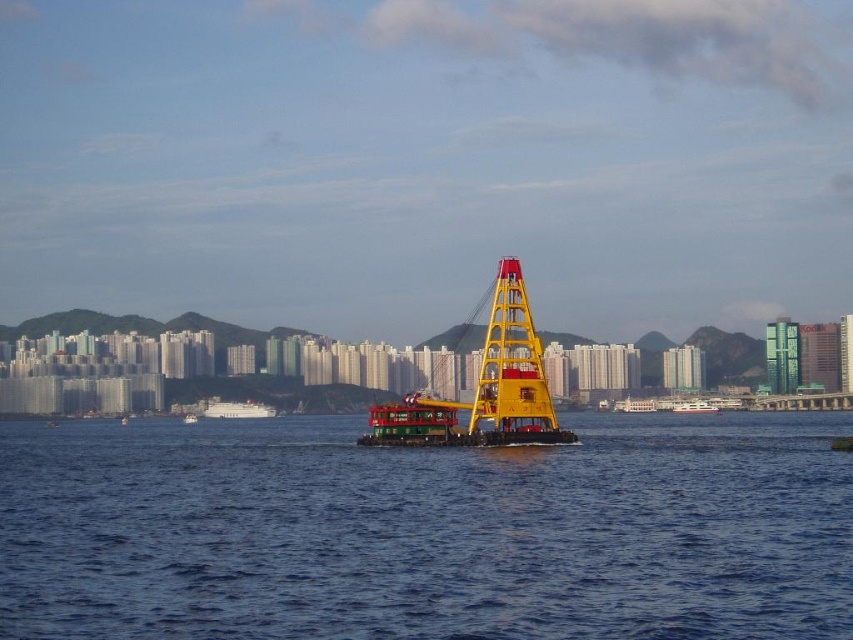
You are a photographer planning to capture the yellow metallic crane at center and the blue water at center in a single shot. Based on their positions, which object will appear taller in your photo?

The yellow metallic crane at center will appear taller in the photo because it is taller than the blue water at center.

You are standing on a pier and want to reach the yellow metallic crane at center. The safety regulations state that you can only approach up to 700 feet. Can you safely walk towards the crane?

The yellow metallic crane at center is 762.19 feet away from the viewer. Since the safety limit is 700 feet, you cannot safely walk towards the crane as you would exceed the allowed distance.

You are standing at the camera position and want to throw a lifebuoy to someone in the blue water at center. If the lifebuoy can travel 400 feet, will it reach them?

The blue water at center and camera are 393.65 feet apart, so yes, the lifebuoy can reach them since it can travel 400 feet.